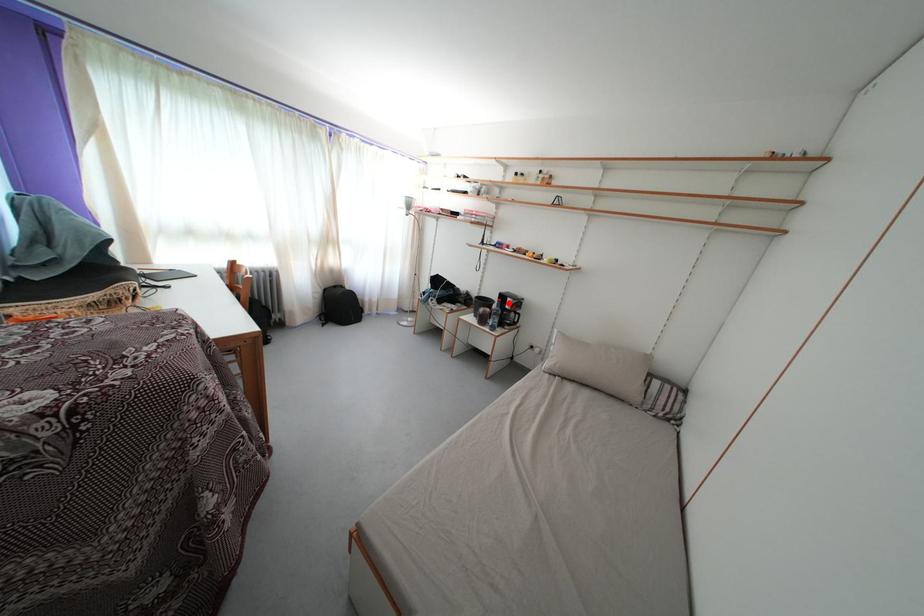
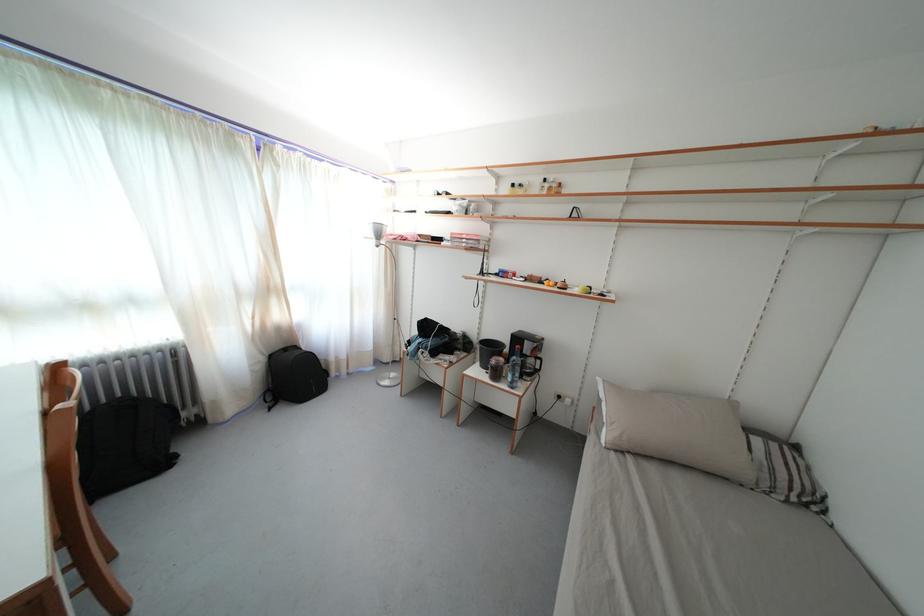
Question: I am providing you with two images of the same scene from different viewpoints. Given a red point in image1, look at the same physical point in image2. Is it:

Choices:
 (A) Closer to the viewpoint
 (B) Farther from the viewpoint

Answer: (B)